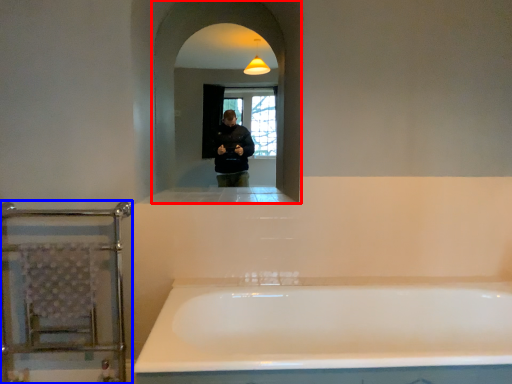
Question: Among these objects, which one is nearest to the camera, mirror (highlighted by a red box) or balustrade (highlighted by a blue box)?

Choices:
 (A) mirror
 (B) balustrade

Answer: (B)